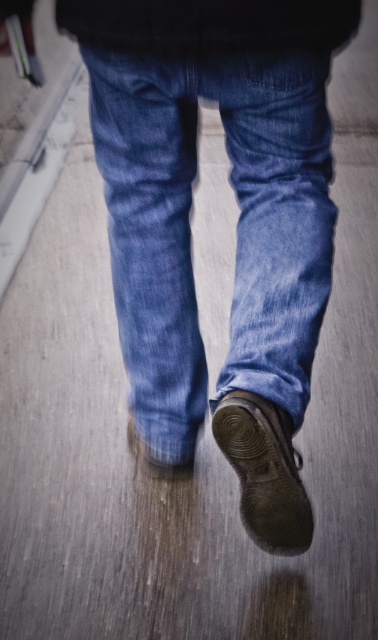
Which is in front, point (312, 122) or point (178, 477)?

Point (312, 122)

Is denim jeans at center wider than matte brown leather shoe at lower center?

Correct, the width of denim jeans at center exceeds that of matte brown leather shoe at lower center.

Which is behind, point (306, 154) or point (182, 468)?

The point (182, 468) is more distant.

Where is `denim jeans at center`? denim jeans at center is located at coordinates (237, 228).

Is denim jeans at center closer to camera compared to leather textured shoe at lower center?

Yes, denim jeans at center is in front of leather textured shoe at lower center.

Is denim jeans at center thinner than leather textured shoe at lower center?

No.

Between point (243, 140) and point (229, 428), which one is positioned in front?

Point (229, 428) is in front.

You are a GUI agent. You are given a task and a screenshot of the screen. Output one action in this format:
    pyautogui.click(x=<x>, y=<y>)
    Task: Click on the denim jeans at center
    
    Given the screenshot: What is the action you would take?
    pyautogui.click(x=237, y=228)

Is leather textured shoe at lower center closer to camera compared to matte brown leather shoe at lower center?

Yes.

Which of these two, leather textured shoe at lower center or matte brown leather shoe at lower center, stands taller?

With more height is leather textured shoe at lower center.

Measure the distance between leather textured shoe at lower center and camera.

A distance of 1.16 meters exists between leather textured shoe at lower center and camera.

Identify the location of leather textured shoe at lower center. (264, 472).